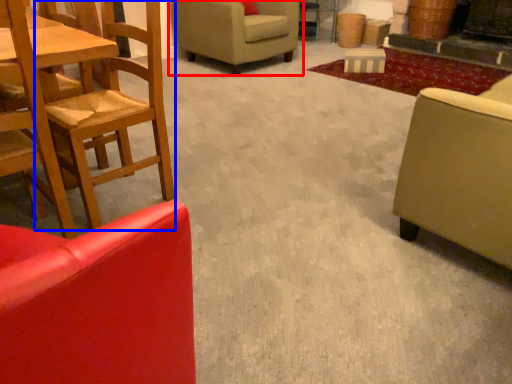
Question: Among these objects, which one is farthest to the camera, chair (highlighted by a red box) or chair (highlighted by a blue box)?

Choices:
 (A) chair
 (B) chair

Answer: (A)